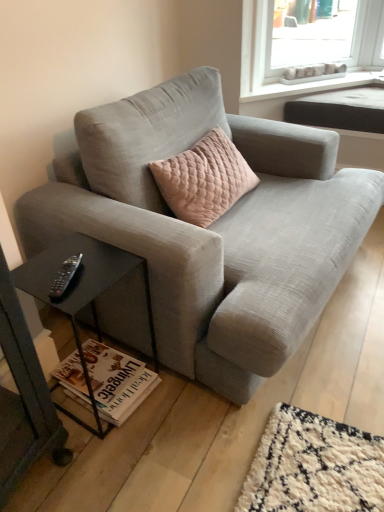
Question: Considering the positions of white plastic tray at upper right, which is the second window sill in front-to-back order, and white matte window sill at upper center, positioned as the 1th window sill in front-to-back order, in the image, is white plastic tray at upper right, which is the second window sill in front-to-back order, bigger or smaller than white matte window sill at upper center, positioned as the 1th window sill in front-to-back order,?

Choices:
 (A) big
 (B) small

Answer: (B)

Question: Is white plastic tray at upper right, which is the second window sill in front-to-back order, spatially inside white matte window sill at upper center, which ranks as the second window sill in back-to-front order, or outside of it?

Choices:
 (A) inside
 (B) outside

Answer: (A)

Question: Estimate the real-world distances between objects in this image. Which object is farther from the white matte window sill at upper center, which ranks as the second window sill in back-to-front order?

Choices:
 (A) white plastic tray at upper right, which is the second window sill in front-to-back order
 (B) black plastic remote at lower left
 (C) white paper magazine at lower left
 (D) black glass table at lower left
 (E) light gray fabric couch at center

Answer: (B)

Question: Based on their relative distances, which object is farther from the black glass table at lower left?

Choices:
 (A) light gray fabric couch at center
 (B) white plastic tray at upper right, which is the second window sill in front-to-back order
 (C) white matte window sill at upper center, which ranks as the second window sill in back-to-front order
 (D) white paper magazine at lower left
 (E) black plastic remote at lower left

Answer: (B)